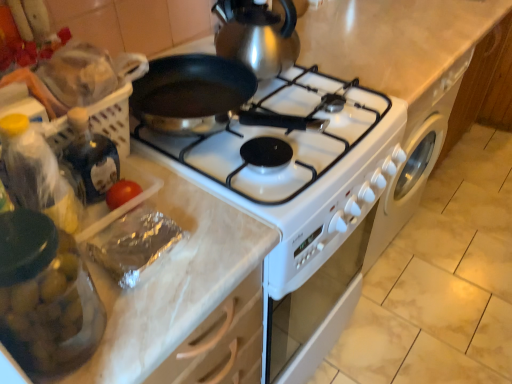
The height and width of the screenshot is (384, 512). Find the location of `shiny metallic gas stove at center`. shiny metallic gas stove at center is located at coordinates (274, 135).

Measure the distance between point (45,345) and camera.

Point (45,345) is 45.70 centimeters away from camera.

Locate an element on the screen. translucent plastic bottle at left is located at coordinates (37, 173).

Is shiny metallic gas stove at center positioned behind transparent glass jar at left?

Yes.

In the scene shown: From a real-world perspective, is shiny metallic gas stove at center on transparent glass jar at left?

No.

In the scene shown: Is shiny metallic gas stove at center inside the boundaries of transparent glass jar at left, or outside?

shiny metallic gas stove at center cannot be found inside transparent glass jar at left.

Between point (59, 266) and point (166, 237), which one is positioned behind?

The point (166, 237) is farther from the camera.

Is the position of transparent glass jar at left less distant than that of silver foil meat at lower left?

Yes, transparent glass jar at left is closer to the viewer.

The height and width of the screenshot is (384, 512). I want to click on food that is behind the transparent glass jar at left, so click(x=135, y=246).

Considering the relative sizes of transparent glass jar at left and translucent plastic bottle at left in the image provided, is transparent glass jar at left bigger than translucent plastic bottle at left?

Yes.

Is the depth of transparent glass jar at left less than that of translucent plastic bottle at left?

Yes, transparent glass jar at left is closer to the camera.

Is transparent glass jar at left oriented away from translucent plastic bottle at left?

No, transparent glass jar at left's orientation is not away from translucent plastic bottle at left.

Is silver foil meat at lower left not close to transparent glass jar at left?

No.

Considering their positions, is silver foil meat at lower left located in front of or behind transparent glass jar at left?

In the image, silver foil meat at lower left appears behind transparent glass jar at left.

How much distance is there between silver foil meat at lower left and transparent glass jar at left?

The distance of silver foil meat at lower left from transparent glass jar at left is 13.98 centimeters.

Could you tell me if silver foil meat at lower left is facing transparent glass jar at left?

No.

Is point (140, 217) farther from camera compared to point (311, 86)?

No, it is not.

How many degrees apart are the facing directions of silver foil meat at lower left and shiny metallic gas stove at center?

They differ by 2.79 degrees in their facing directions.

Is silver foil meat at lower left positioned with its back to shiny metallic gas stove at center?

silver foil meat at lower left does not have its back to shiny metallic gas stove at center.

Are silver foil meat at lower left and shiny metallic gas stove at center located far from each other?

No, silver foil meat at lower left is in close proximity to shiny metallic gas stove at center.

Which object is wider, translucent plastic bottle at left or silver foil meat at lower left?

silver foil meat at lower left is wider.

Measure the distance from translucent plastic bottle at left to silver foil meat at lower left.

A distance of 10.63 centimeters exists between translucent plastic bottle at left and silver foil meat at lower left.

Does translucent plastic bottle at left appear on the right side of silver foil meat at lower left?

Incorrect, translucent plastic bottle at left is not on the right side of silver foil meat at lower left.

From a real-world perspective, is translucent plastic bottle at left over silver foil meat at lower left?

Indeed, from a real-world perspective, translucent plastic bottle at left stands above silver foil meat at lower left.

Is shiny metallic gas stove at center looking in the opposite direction of translucent plastic bottle at left?

No.

In the image, is shiny metallic gas stove at center positioned in front of or behind translucent plastic bottle at left?

Visually, shiny metallic gas stove at center is located behind translucent plastic bottle at left.

Does shiny metallic gas stove at center have a larger size compared to translucent plastic bottle at left?

Correct, shiny metallic gas stove at center is larger in size than translucent plastic bottle at left.

How different are the orientations of shiny metallic gas stove at center and translucent plastic bottle at left in degrees?

They differ by 1.6 degrees in their facing directions.

At what (x,y) coordinates should I click in order to perform the action: click on gas stove beneath the transparent glass jar at left (from a real-world perspective). Please return your answer as a coordinate pair (x, y). Looking at the image, I should click on (274, 135).

At what (x,y) coordinates should I click in order to perform the action: click on kitchen appliance on the left of silver foil meat at lower left. Please return your answer as a coordinate pair (x, y). Looking at the image, I should click on (46, 296).

Looking at the image, which one is located further to silver foil meat at lower left, transparent glass jar at left or shiny metallic gas stove at center?

The object further to silver foil meat at lower left is shiny metallic gas stove at center.

When comparing their distances from translucent plastic bottle at left, does transparent glass jar at left or silver foil meat at lower left seem further?

transparent glass jar at left is positioned further to the anchor translucent plastic bottle at left.

Considering their positions, is silver foil meat at lower left positioned closer to shiny metallic gas stove at center than transparent glass jar at left?

Among the two, silver foil meat at lower left is located nearer to shiny metallic gas stove at center.

From the picture: Which object lies nearer to the anchor point shiny metallic gas stove at center, transparent glass jar at left or silver foil meat at lower left?

silver foil meat at lower left is closer to shiny metallic gas stove at center.

Based on their spatial positions, is shiny metallic gas stove at center or transparent glass jar at left closer to silver foil meat at lower left?

transparent glass jar at left is closer to silver foil meat at lower left.

Which object lies nearer to the anchor point shiny metallic gas stove at center, translucent plastic bottle at left or silver foil meat at lower left?

silver foil meat at lower left is positioned closer to the anchor shiny metallic gas stove at center.

Based on their spatial positions, is silver foil meat at lower left or transparent glass jar at left closer to translucent plastic bottle at left?

Among the two, silver foil meat at lower left is located nearer to translucent plastic bottle at left.

When comparing their distances from silver foil meat at lower left, does translucent plastic bottle at left or shiny metallic gas stove at center seem closer?

translucent plastic bottle at left.

Identify the location of food between shiny metallic gas stove at center and transparent glass jar at left in the up-down direction. The width and height of the screenshot is (512, 384). (135, 246).

I want to click on bottle positioned between transparent glass jar at left and silver foil meat at lower left from near to far, so click(x=37, y=173).

Identify the location of bottle between shiny metallic gas stove at center and silver foil meat at lower left vertically. (37, 173).

The height and width of the screenshot is (384, 512). I want to click on bottle between shiny metallic gas stove at center and transparent glass jar at left from top to bottom, so click(37, 173).